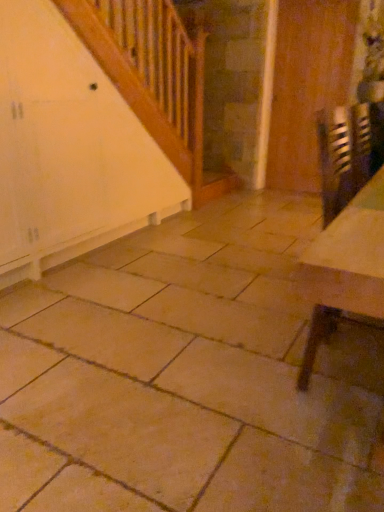
The width and height of the screenshot is (384, 512). I want to click on free spot in front of metallic reflective table at lower right, so pos(327,440).